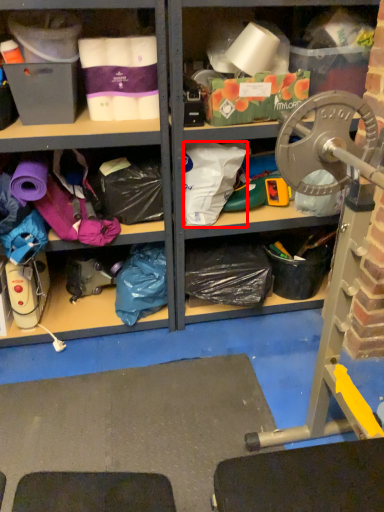
Question: From the image's perspective, what is the correct spatial positioning of clothing (annotated by the red box) in reference to clothing?

Choices:
 (A) below
 (B) above

Answer: (B)